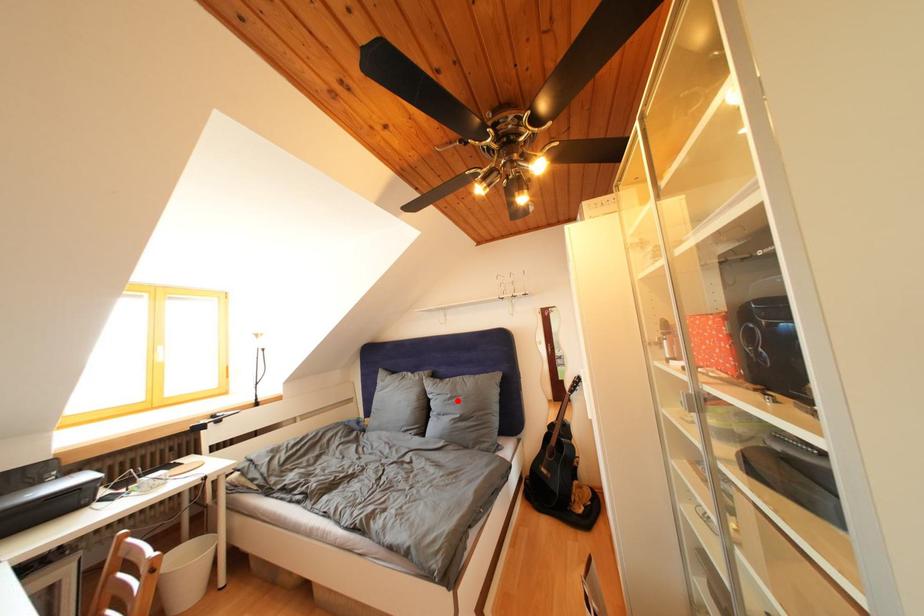
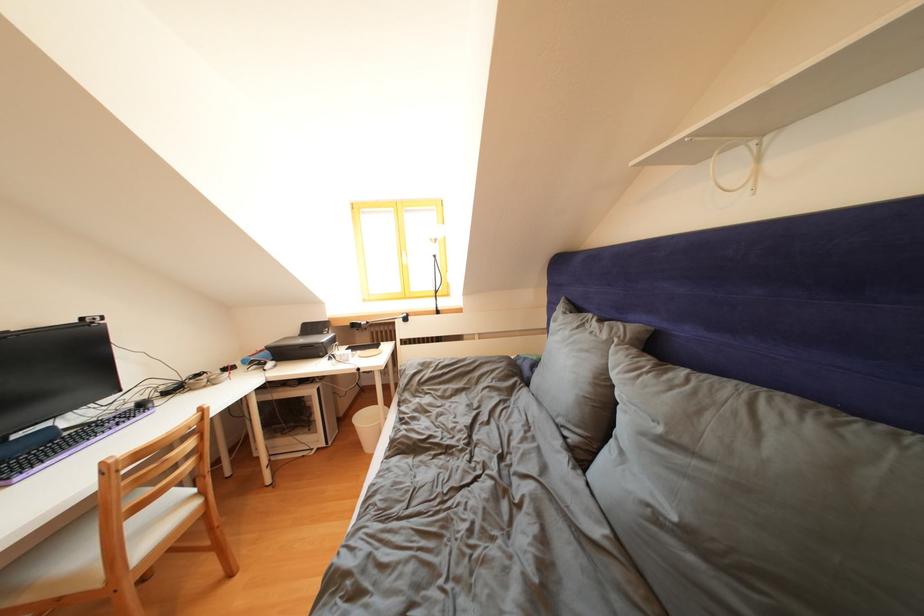
Find the pixel in the second image that matches the highlighted location in the first image.

(667, 435)